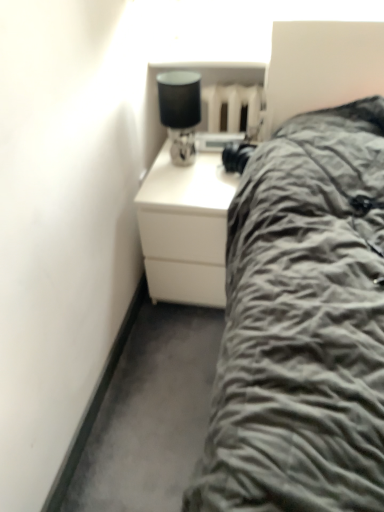
The width and height of the screenshot is (384, 512). What are the coordinates of `vacant area in front of white matte chest of drawers at center` in the screenshot? It's located at [x=175, y=348].